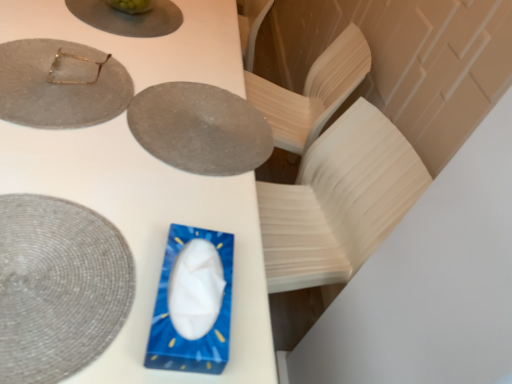
Question: Is blue plastic tissue box at center turned away from gold metallic glasses at upper left?

Choices:
 (A) yes
 (B) no

Answer: (B)

Question: Is blue plastic tissue box at center to the right of gold metallic glasses at upper left from the viewer's perspective?

Choices:
 (A) no
 (B) yes

Answer: (A)

Question: Does blue plastic tissue box at center have a lesser width compared to gold metallic glasses at upper left?

Choices:
 (A) no
 (B) yes

Answer: (A)

Question: From the image's perspective, does blue plastic tissue box at center appear lower than gold metallic glasses at upper left?

Choices:
 (A) no
 (B) yes

Answer: (A)

Question: Could you tell me if blue plastic tissue box at center is turned towards gold metallic glasses at upper left?

Choices:
 (A) no
 (B) yes

Answer: (A)

Question: In the image, is matte gray plate at upper center, positioned as the 1th plate in top-to-bottom order, positioned in front of or behind blue plastic tissue box at center?

Choices:
 (A) front
 (B) behind

Answer: (B)

Question: Based on their positions, is matte gray plate at upper center, positioned as the 1th plate in top-to-bottom order, located to the left or right of blue plastic tissue box at center?

Choices:
 (A) right
 (B) left

Answer: (A)

Question: From the image's perspective, is matte gray plate at upper center, positioned as the 1th plate in top-to-bottom order, located above or below blue plastic tissue box at center?

Choices:
 (A) below
 (B) above

Answer: (B)

Question: From their relative heights in the image, would you say matte gray plate at upper center, positioned as the 1th plate in top-to-bottom order, is taller or shorter than blue plastic tissue box at center?

Choices:
 (A) short
 (B) tall

Answer: (A)

Question: From the image's perspective, is matte gray plate at upper center, placed as the third plate when sorted from top to bottom, located above or below matte gray plate at upper center, positioned as the 1th plate in top-to-bottom order?

Choices:
 (A) above
 (B) below

Answer: (B)

Question: Considering the positions of point (196, 119) and point (164, 29), is point (196, 119) closer or farther from the camera than point (164, 29)?

Choices:
 (A) closer
 (B) farther

Answer: (A)

Question: From a real-world perspective, is matte gray plate at upper center, the second plate positioned from the bottom, above or below matte gray plate at upper center, positioned as the 1th plate in top-to-bottom order?

Choices:
 (A) below
 (B) above

Answer: (A)

Question: Looking at the image, does matte gray plate at upper center, placed as the third plate when sorted from top to bottom, seem bigger or smaller compared to matte gray plate at upper center, the 4th plate positioned from the bottom?

Choices:
 (A) big
 (B) small

Answer: (A)

Question: Based on their positions, is matte gray plate at upper center, the 4th plate positioned from the bottom, located to the left or right of matte gray placemat at lower left, arranged as the 4th plate when viewed from the top?

Choices:
 (A) right
 (B) left

Answer: (B)

Question: From the image's perspective, is matte gray plate at upper center, positioned as the 1th plate in top-to-bottom order, located above or below matte gray placemat at lower left, arranged as the 4th plate when viewed from the top?

Choices:
 (A) below
 (B) above

Answer: (B)